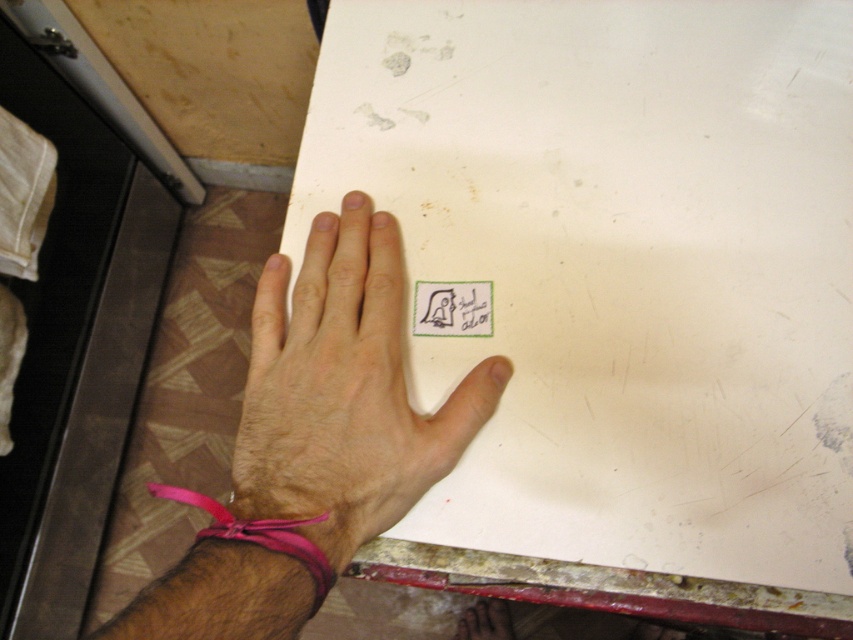
Is white matte paper at center below hair-covered skin at center?

Incorrect, white matte paper at center is not positioned below hair-covered skin at center.

Image resolution: width=853 pixels, height=640 pixels. What do you see at coordinates (618, 266) in the screenshot? I see `white matte paper at center` at bounding box center [618, 266].

Identify the location of white matte paper at center. (618, 266).

Is hair-covered skin at center wider than pink fabric wristband at lower center?

Indeed, hair-covered skin at center has a greater width compared to pink fabric wristband at lower center.

Describe the element at coordinates (343, 390) in the screenshot. The image size is (853, 640). I see `hair-covered skin at center` at that location.

At what (x,y) coordinates should I click in order to perform the action: click on hair-covered skin at center. Please return your answer as a coordinate pair (x, y). This screenshot has width=853, height=640. Looking at the image, I should click on (343, 390).

Between green fabric sticker at center and pink fabric wristband at lower center, which one appears on the left side from the viewer's perspective?

green fabric sticker at center is more to the left.

Is point (430, 300) in front of point (502, 598)?

Yes, point (430, 300) is closer to viewer.

Find the location of `green fabric sticker at center`. green fabric sticker at center is located at coordinates (451, 308).